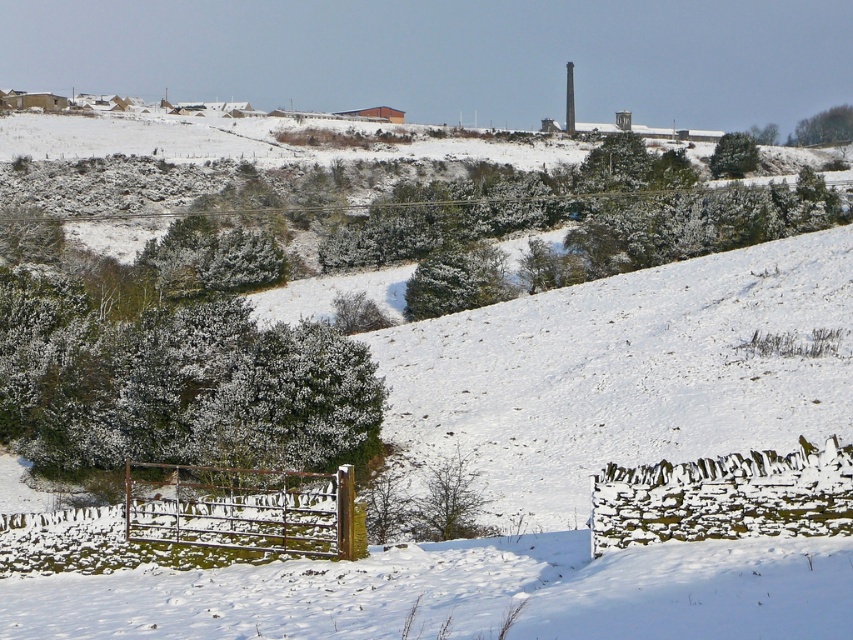
Is point (248, 534) closer to camera compared to point (822, 109)?

Yes, point (248, 534) is closer to viewer.

Does brown metal fence at lower center appear over green leafy tree at upper right?

Incorrect, brown metal fence at lower center is not positioned above green leafy tree at upper right.

Which is behind, point (268, 541) or point (822, 131)?

The point (822, 131) is more distant.

At what (x,y) coordinates should I click in order to perform the action: click on brown metal fence at lower center. Please return your answer as a coordinate pair (x, y). The height and width of the screenshot is (640, 853). Looking at the image, I should click on (244, 509).

Does green textured bush at left have a greater width compared to brown metal fence at lower center?

Yes.

What do you see at coordinates (177, 365) in the screenshot? I see `green textured bush at left` at bounding box center [177, 365].

The height and width of the screenshot is (640, 853). Find the location of `green textured bush at left`. green textured bush at left is located at coordinates (177, 365).

Is green textured bush at left behind green matte tree at upper right?

No, green textured bush at left is in front of green matte tree at upper right.

Is green textured bush at left smaller than green matte tree at upper right?

Correct, green textured bush at left occupies less space than green matte tree at upper right.

What do you see at coordinates (177, 365) in the screenshot?
I see `green textured bush at left` at bounding box center [177, 365].

At what (x,y) coordinates should I click in order to perform the action: click on green textured bush at left. Please return your answer as a coordinate pair (x, y). The height and width of the screenshot is (640, 853). Looking at the image, I should click on (177, 365).